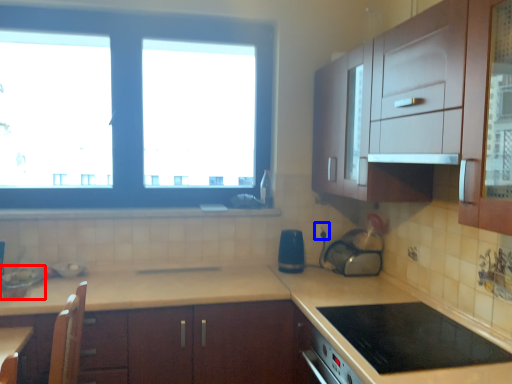
Question: Which of the following is the closest to the observer, appliance (highlighted by a red box) or electric outlet (highlighted by a blue box)?

Choices:
 (A) appliance
 (B) electric outlet

Answer: (A)